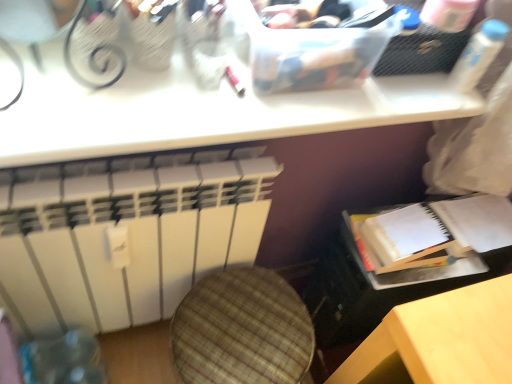
Question: Is white paper journal at lower right positioned behind white matte radiator at lower left?

Choices:
 (A) yes
 (B) no

Answer: (A)

Question: Can white matte radiator at lower left be found inside white paper journal at lower right?

Choices:
 (A) yes
 (B) no

Answer: (B)

Question: Considering the relative positions of white paper journal at lower right and white matte radiator at lower left in the image provided, is white paper journal at lower right to the right of white matte radiator at lower left from the viewer's perspective?

Choices:
 (A) yes
 (B) no

Answer: (A)

Question: From a real-world perspective, is white paper journal at lower right located beneath white matte radiator at lower left?

Choices:
 (A) yes
 (B) no

Answer: (B)

Question: Is white paper journal at lower right beside white matte radiator at lower left?

Choices:
 (A) no
 (B) yes

Answer: (A)

Question: From their relative heights in the image, would you say white plastic table at upper center is taller or shorter than white matte radiator at lower left?

Choices:
 (A) tall
 (B) short

Answer: (B)

Question: Is white plastic table at upper center wider or thinner than white matte radiator at lower left?

Choices:
 (A) thin
 (B) wide

Answer: (B)

Question: Is white plastic table at upper center in front of or behind white matte radiator at lower left in the image?

Choices:
 (A) front
 (B) behind

Answer: (A)

Question: Is white plastic table at upper center bigger or smaller than white matte radiator at lower left?

Choices:
 (A) big
 (B) small

Answer: (B)

Question: Does point pyautogui.click(x=494, y=34) appear closer or farther from the camera than point pyautogui.click(x=133, y=286)?

Choices:
 (A) farther
 (B) closer

Answer: (B)

Question: From the image's perspective, is white plastic bottle at upper right above or below white matte radiator at lower left?

Choices:
 (A) above
 (B) below

Answer: (A)

Question: Which is correct: white plastic bottle at upper right is inside white matte radiator at lower left, or outside of it?

Choices:
 (A) outside
 (B) inside

Answer: (A)

Question: In terms of height, does white plastic bottle at upper right look taller or shorter compared to white matte radiator at lower left?

Choices:
 (A) tall
 (B) short

Answer: (B)

Question: Would you say plaid fabric swivel chair at lower left is to the left or to the right of white matte radiator at lower left in the picture?

Choices:
 (A) right
 (B) left

Answer: (A)

Question: Looking at their shapes, would you say plaid fabric swivel chair at lower left is wider or thinner than white matte radiator at lower left?

Choices:
 (A) wide
 (B) thin

Answer: (A)